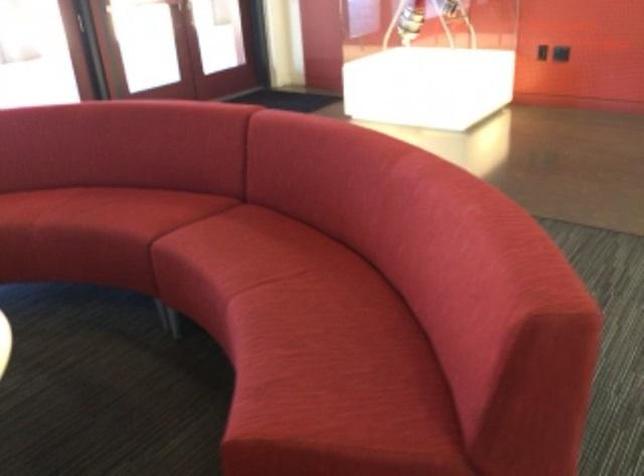
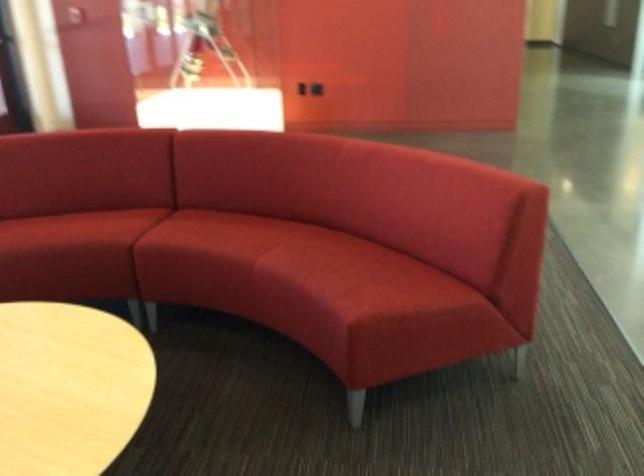
In the second image, find the point that corresponds to (x=305, y=317) in the first image.

(328, 258)